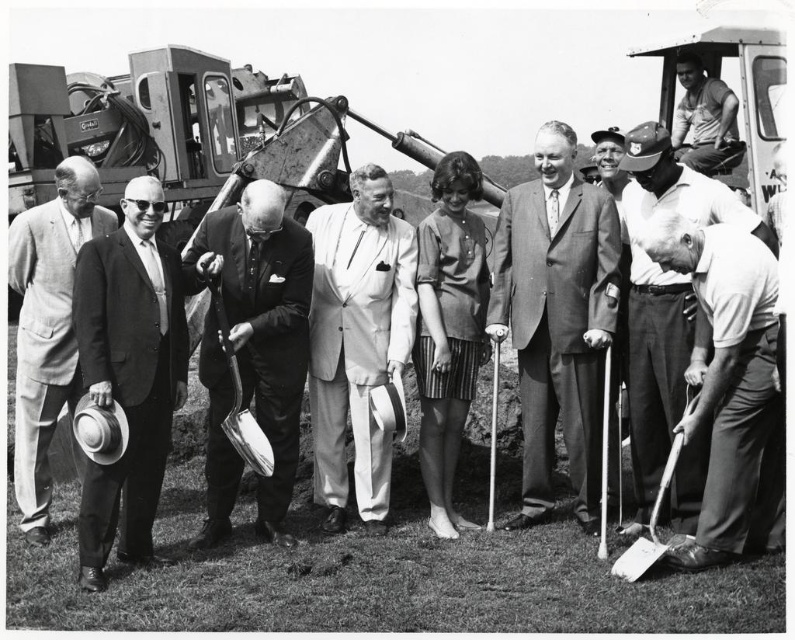
Does point (92, 292) come farther from viewer compared to point (51, 387)?

No, (92, 292) is in front of (51, 387).

Is light brown straw hat at left in front of light gray suit at left?

Yes, it is in front of light gray suit at left.

Locate an element on the screen. The height and width of the screenshot is (640, 795). light brown straw hat at left is located at coordinates (130, 371).

What are the coordinates of `light brown straw hat at left` in the screenshot? It's located at (130, 371).

Who is more forward, (526,500) or (753,225)?

Point (753,225) is more forward.

Which is below, smooth suit at center or white cotton shirt at lower right?

smooth suit at center is lower down.

Is point (591, 332) positioned in front of point (646, 369)?

Yes, it is in front of point (646, 369).

Image resolution: width=795 pixels, height=640 pixels. Identify the location of smooth suit at center. (556, 320).

Is point (256, 497) closer to viewer compared to point (14, 228)?

That is False.

In the scene shown: Does shiny silver shovel at center appear on the right side of light gray suit at left?

Yes, shiny silver shovel at center is to the right of light gray suit at left.

In order to click on shiny silver shovel at center in this screenshot , I will do `click(264, 324)`.

Identify the location of shiny silver shovel at center. This screenshot has width=795, height=640. pyautogui.click(x=264, y=324).